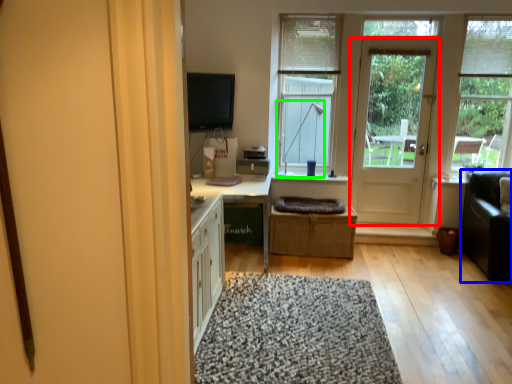
Question: Estimate the real-world distances between objects in this image. Which object is closer to door (highlighted by a red box), couch (highlighted by a blue box) or lamp (highlighted by a green box)?

Choices:
 (A) couch
 (B) lamp

Answer: (B)